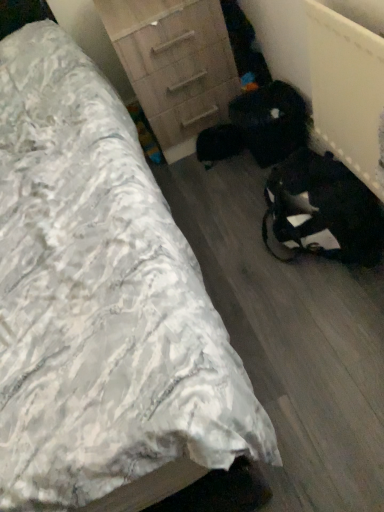
Measure the distance between point (x=33, y=476) and camera.

30.51 inches.

What do you see at coordinates (100, 298) in the screenshot?
I see `white textured bed at center` at bounding box center [100, 298].

The image size is (384, 512). Find the location of `white textured bed at center`. white textured bed at center is located at coordinates (100, 298).

In the scene shown: What is the approximate height of white textured bed at center?

35.33 inches.

This screenshot has width=384, height=512. I want to click on wooden chest of drawers at center, so 174,65.

The height and width of the screenshot is (512, 384). Describe the element at coordinates (174, 65) in the screenshot. I see `wooden chest of drawers at center` at that location.

The width and height of the screenshot is (384, 512). Identify the location of white textured bed at center. [100, 298].

Is white textured bed at center to the left of wooden chest of drawers at center from the viewer's perspective?

Yes, white textured bed at center is to the left of wooden chest of drawers at center.

Is the position of white textured bed at center less distant than that of wooden chest of drawers at center?

Yes, the depth of white textured bed at center is less than that of wooden chest of drawers at center.

Considering the points (13, 261) and (197, 39), which point is behind, point (13, 261) or point (197, 39)?

The point (197, 39) is behind.

From the image's perspective, is white textured bed at center beneath wooden chest of drawers at center?

Yes, from the image's perspective, white textured bed at center is below wooden chest of drawers at center.

From a real-world perspective, between white textured bed at center and wooden chest of drawers at center, who is vertically higher?

white textured bed at center, from a real-world perspective.

Considering the sizes of objects white textured bed at center and wooden chest of drawers at center in the image provided, who is wider, white textured bed at center or wooden chest of drawers at center?

Wider between the two is white textured bed at center.

Between white textured bed at center and wooden chest of drawers at center, which one has less height?

Standing shorter between the two is wooden chest of drawers at center.

Between white textured bed at center and wooden chest of drawers at center, which one has larger size?

white textured bed at center.

Would you say white textured bed at center contains wooden chest of drawers at center?

No, wooden chest of drawers at center is not surrounded by white textured bed at center.

Looking at this image, are white textured bed at center and wooden chest of drawers at center located far from each other?

No.

Is white textured bed at center aimed at wooden chest of drawers at center?

No, white textured bed at center is not aimed at wooden chest of drawers at center.

How far apart are white textured bed at center and wooden chest of drawers at center?

white textured bed at center is 23.79 inches away from wooden chest of drawers at center.

Find the location of a particular element. The image size is (384, 512). chest of drawers behind the white textured bed at center is located at coordinates (174, 65).

Does wooden chest of drawers at center appear on the right side of white textured bed at center?

Indeed, wooden chest of drawers at center is positioned on the right side of white textured bed at center.

Does wooden chest of drawers at center lie in front of white textured bed at center?

No, wooden chest of drawers at center is further to the viewer.

Is point (164, 83) more distant than point (0, 471)?

Yes, it is.

From the image's perspective, does wooden chest of drawers at center appear higher than white textured bed at center?

Indeed, from the image's perspective, wooden chest of drawers at center is shown above white textured bed at center.

From a real-world perspective, does wooden chest of drawers at center sit lower than white textured bed at center?

Yes, from a real-world perspective, wooden chest of drawers at center is beneath white textured bed at center.

Is wooden chest of drawers at center thinner than white textured bed at center?

Correct, the width of wooden chest of drawers at center is less than that of white textured bed at center.

Who is shorter, wooden chest of drawers at center or white textured bed at center?

wooden chest of drawers at center.

Is wooden chest of drawers at center bigger or smaller than white textured bed at center?

wooden chest of drawers at center is smaller than white textured bed at center.

Is wooden chest of drawers at center inside the boundaries of white textured bed at center, or outside?

wooden chest of drawers at center is spatially situated outside white textured bed at center.

Is the surface of wooden chest of drawers at center in direct contact with white textured bed at center?

No, wooden chest of drawers at center is not beside white textured bed at center.

Is wooden chest of drawers at center oriented towards white textured bed at center?

No, wooden chest of drawers at center is not aimed at white textured bed at center.

Where is `bed in front of the wooden chest of drawers at center`? bed in front of the wooden chest of drawers at center is located at coordinates (100, 298).

Find the location of a particular element. chest of drawers that appears on the right of white textured bed at center is located at coordinates pyautogui.click(x=174, y=65).

Image resolution: width=384 pixels, height=512 pixels. There is a wooden chest of drawers at center. In order to click on bed above it (from a real-world perspective) in this screenshot , I will do `click(100, 298)`.